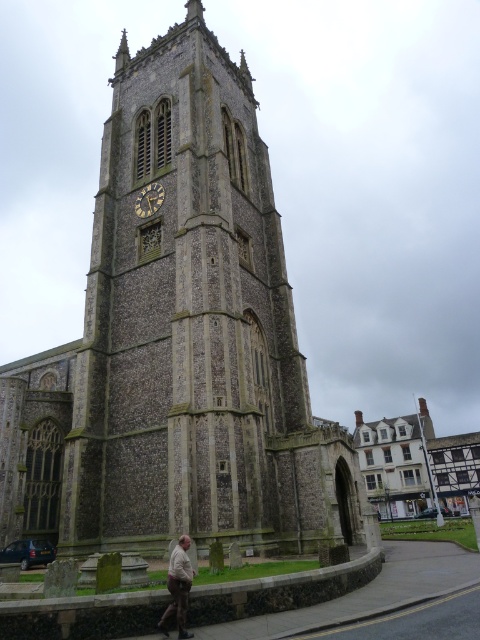
You are standing in front of the historic church and want to take a photo of both the stone clock tower at center and the gold textured clock at center. Which object should you focus on first to ensure both are in frame?

The stone clock tower at center is positioned under the gold textured clock at center, so you should focus on the gold textured clock at center first to ensure both are in frame.

You are standing on the pathway leading to the church entrance and see the stone clock tower at center and the brown leather jacket at lower center. Which object is located to the right of the other?

The stone clock tower at center is positioned on the left side of brown leather jacket at lower center, so the brown leather jacket at lower center is to the right of the stone clock tower at center.

You are standing at the entrance of the historic church tower and notice a brown leather jacket at lower center and a gold textured clock at center. Which object is closer to you?

The brown leather jacket at lower center is closer to you because it is in front of the gold textured clock at center.